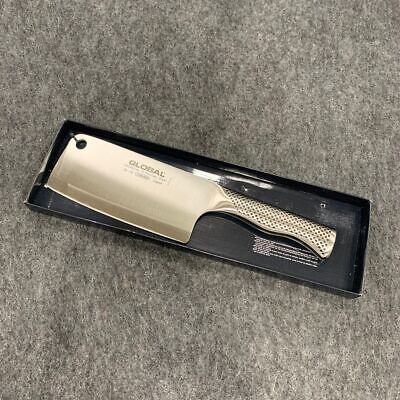
Image resolution: width=400 pixels, height=400 pixels. In order to click on knife handle in this screenshot , I will do `click(263, 213)`, `click(300, 229)`.